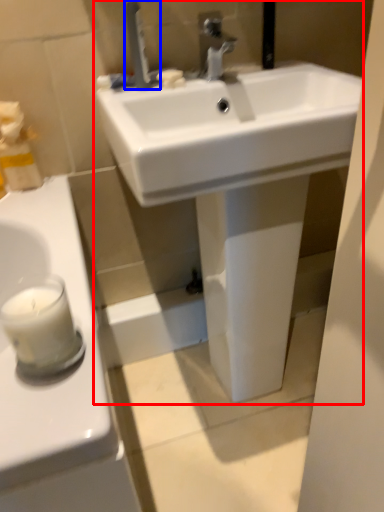
Question: Which of the following is the farthest to the observer, sink (highlighted by a red box) or tap (highlighted by a blue box)?

Choices:
 (A) sink
 (B) tap

Answer: (B)